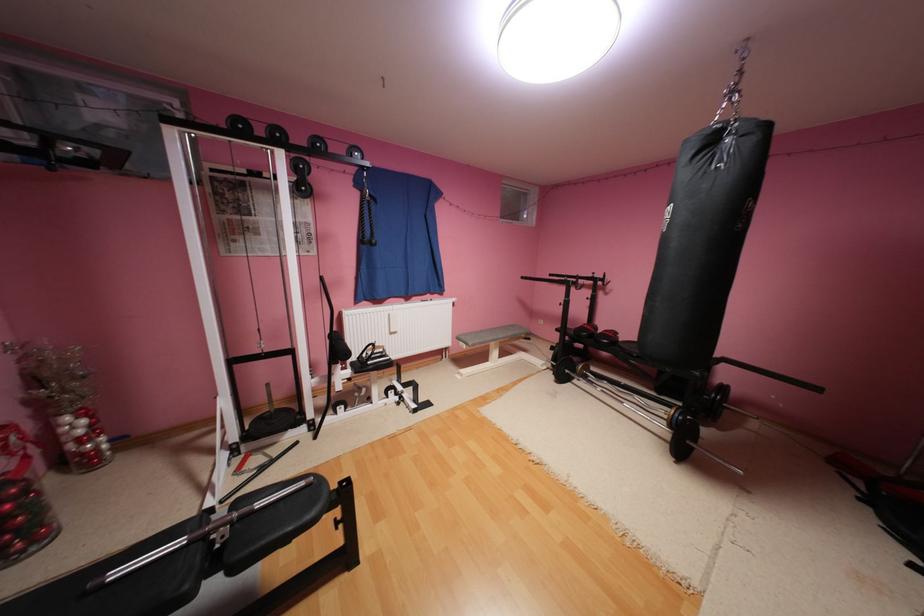
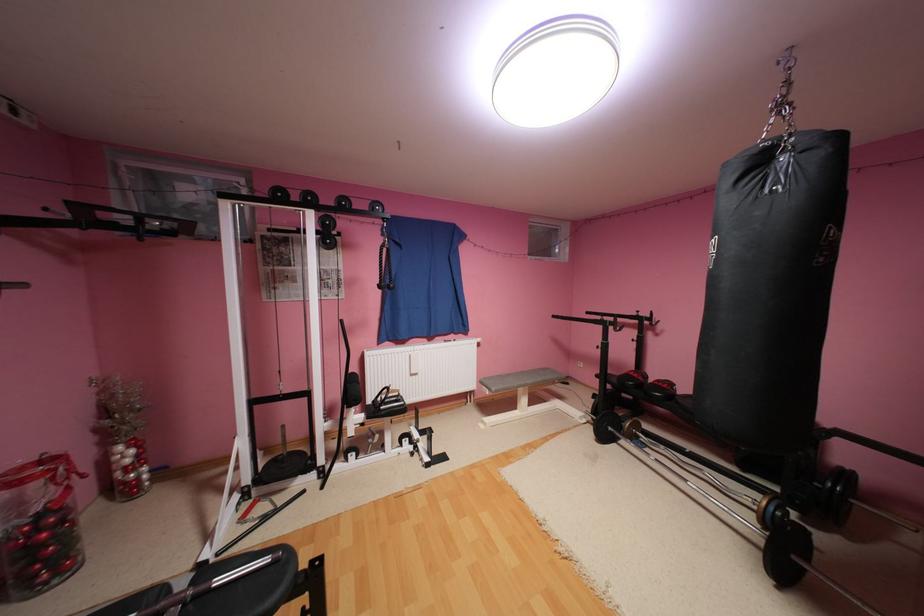
In the second image, find the point that corresponds to (310,484) in the first image.

(276, 560)